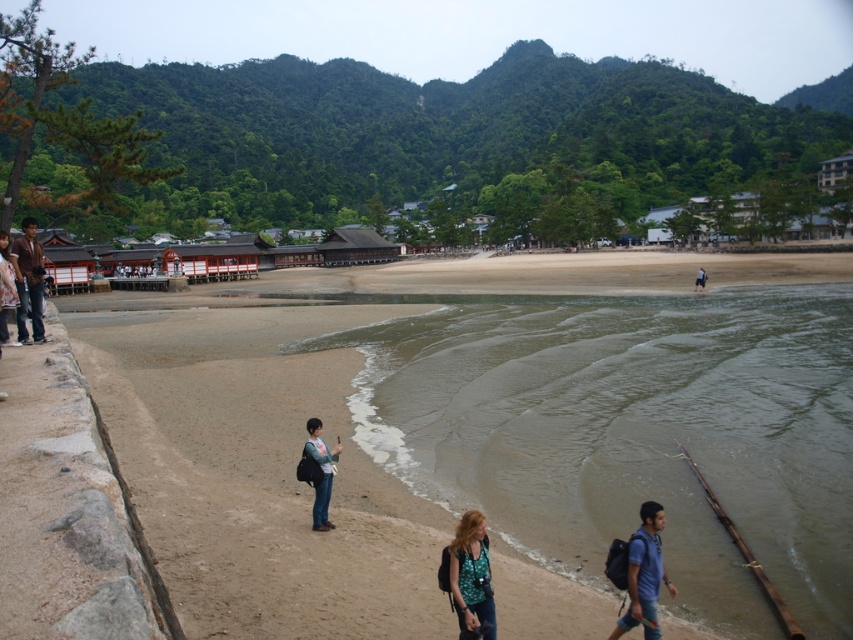
You are a photographer positioned on the beach. You want to take a photo of the traditional Japanese buildings in the midground. However, you notice two items in your frame that might obstruct the view. These items are the matte brown jacket at left and the dark blue jeans at lower left. Which item is closer to you and would block the view of the buildings more significantly?

The matte brown jacket at left is closer to you than the dark blue jeans at lower left, so it would block the view of the traditional Japanese buildings more significantly.

You are a photographer trying to capture a shot of the coastal scene. You notice the matte brown jacket at left and the dark blue jeans at lower left. Which object is wider in the image?

The matte brown jacket at left might be wider than dark blue jeans at lower left according to the description.

You are standing on the beach and see two pairs of jeans, the blue denim jeans at lower right and the dark blue jeans at lower left. Which pair is shorter in height?

The blue denim jeans at lower right has a lesser height compared to the dark blue jeans at lower left, so the blue denim jeans at lower right is shorter.